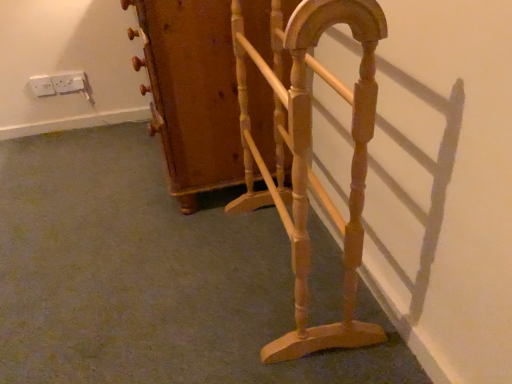
Question: Is white plastic socket at upper left, which is the 2th electric outlet in left-to-right order, not within light brown wood magazine rack at center, which is counted as the 2th furniture, starting from the back?

Choices:
 (A) yes
 (B) no

Answer: (A)

Question: Is white plastic socket at upper left, the first electric outlet in the right-to-left sequence, shorter than light brown wood magazine rack at center, the first furniture when ordered from front to back?

Choices:
 (A) no
 (B) yes

Answer: (B)

Question: From a real-world perspective, is white plastic socket at upper left, which is the 2th electric outlet in left-to-right order, below light brown wood magazine rack at center, the first furniture when ordered from front to back?

Choices:
 (A) no
 (B) yes

Answer: (B)

Question: Is white plastic socket at upper left, which is the 2th electric outlet in left-to-right order, at the right side of light brown wood magazine rack at center, the first furniture when ordered from front to back?

Choices:
 (A) yes
 (B) no

Answer: (B)

Question: Is white plastic socket at upper left, the first electric outlet in the right-to-left sequence, turned away from light brown wood magazine rack at center, which is counted as the 2th furniture, starting from the back?

Choices:
 (A) no
 (B) yes

Answer: (A)

Question: In terms of size, does white plastic socket at upper left, the first electric outlet in the right-to-left sequence, appear bigger or smaller than light brown wood magazine rack at center, which is counted as the 2th furniture, starting from the back?

Choices:
 (A) small
 (B) big

Answer: (A)

Question: Is white plastic socket at upper left, the first electric outlet in the right-to-left sequence, to the left or to the right of light brown wood magazine rack at center, which is counted as the 2th furniture, starting from the back, in the image?

Choices:
 (A) left
 (B) right

Answer: (A)

Question: In terms of width, does white plastic socket at upper left, which is the 2th electric outlet in left-to-right order, look wider or thinner when compared to light brown wood magazine rack at center, which is counted as the 2th furniture, starting from the back?

Choices:
 (A) thin
 (B) wide

Answer: (A)

Question: From the image's perspective, relative to light brown wood magazine rack at center, which is counted as the 2th furniture, starting from the back, is white plastic socket at upper left, the first electric outlet in the right-to-left sequence, above or below?

Choices:
 (A) above
 (B) below

Answer: (A)

Question: Based on their positions, is white plastic socket at upper left, which is the 2th electric outlet in left-to-right order, located to the left or right of white plastic socket at upper left, which is counted as the first electric outlet, starting from the left?

Choices:
 (A) right
 (B) left

Answer: (A)

Question: From the image's perspective, is white plastic socket at upper left, which is the 2th electric outlet in left-to-right order, positioned above or below white plastic socket at upper left, which is counted as the first electric outlet, starting from the left?

Choices:
 (A) above
 (B) below

Answer: (A)

Question: Is white plastic socket at upper left, the first electric outlet in the right-to-left sequence, inside the boundaries of white plastic socket at upper left, which is the 2th electric outlet in right-to-left order, or outside?

Choices:
 (A) inside
 (B) outside

Answer: (B)

Question: Looking at the image, does white plastic socket at upper left, the first electric outlet in the right-to-left sequence, seem bigger or smaller compared to white plastic socket at upper left, which is counted as the first electric outlet, starting from the left?

Choices:
 (A) big
 (B) small

Answer: (A)

Question: Relative to white plastic socket at upper left, which is the 2th electric outlet in left-to-right order, is white plastic socket at upper left, which is the 2th electric outlet in right-to-left order, in front or behind?

Choices:
 (A) front
 (B) behind

Answer: (A)

Question: Considering the relative positions of white plastic socket at upper left, which is counted as the first electric outlet, starting from the left, and white plastic socket at upper left, the first electric outlet in the right-to-left sequence, in the image provided, is white plastic socket at upper left, which is counted as the first electric outlet, starting from the left, to the left or to the right of white plastic socket at upper left, the first electric outlet in the right-to-left sequence,?

Choices:
 (A) right
 (B) left

Answer: (B)